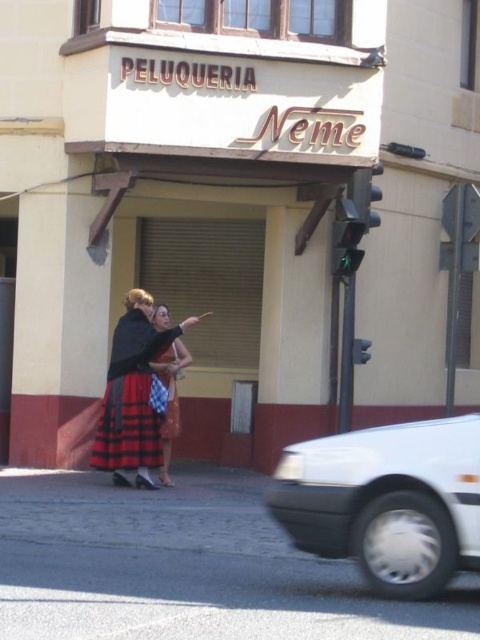
Between plaid skirt at center and plaid fabric dress at center, which one is positioned lower?

Positioned lower is plaid skirt at center.

Where is `plaid skirt at center`? The height and width of the screenshot is (640, 480). plaid skirt at center is located at coordinates (169, 400).

Locate an element on the screen. The image size is (480, 640). plaid skirt at center is located at coordinates 169,400.

Does red plaid skirt at center appear over plaid skirt at center?

Yes.

Is red plaid skirt at center behind plaid skirt at center?

No.

Locate an element on the screen. The width and height of the screenshot is (480, 640). red plaid skirt at center is located at coordinates (134, 394).

Where is `red plaid skirt at center`? This screenshot has width=480, height=640. red plaid skirt at center is located at coordinates (134, 394).

Can you confirm if red plaid skirt at center is shorter than plaid fabric dress at center?

In fact, red plaid skirt at center may be taller than plaid fabric dress at center.

Which is in front, point (104, 394) or point (177, 348)?

Point (177, 348) is more forward.

The image size is (480, 640). I want to click on red plaid skirt at center, so click(134, 394).